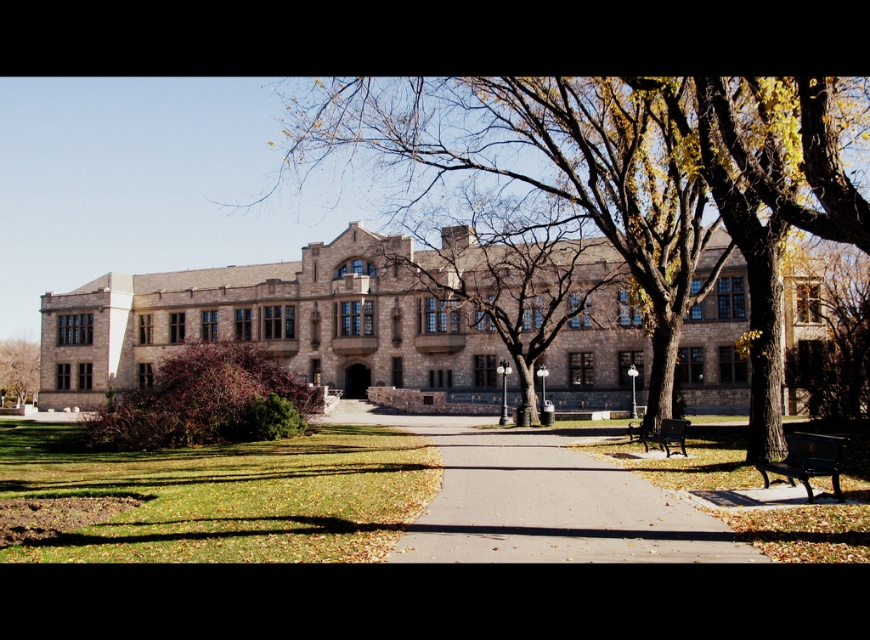
You are standing at the entrance of the historic stone building and want to take a photo of the brown textured tree at center. Which direction should you face to capture the tree in your view?

The brown textured tree at center is located at point coordinates, so you should face towards the center of the image to capture it in your view.